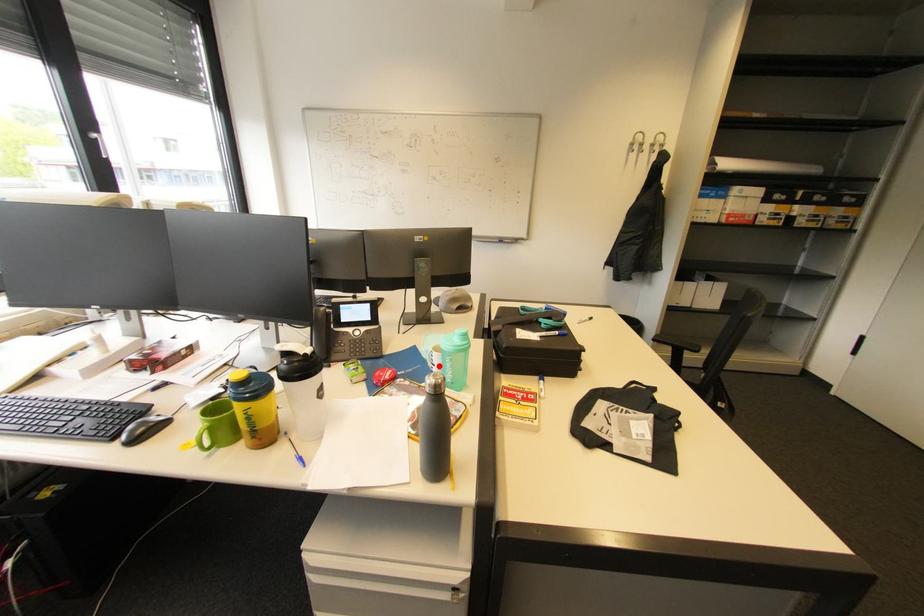
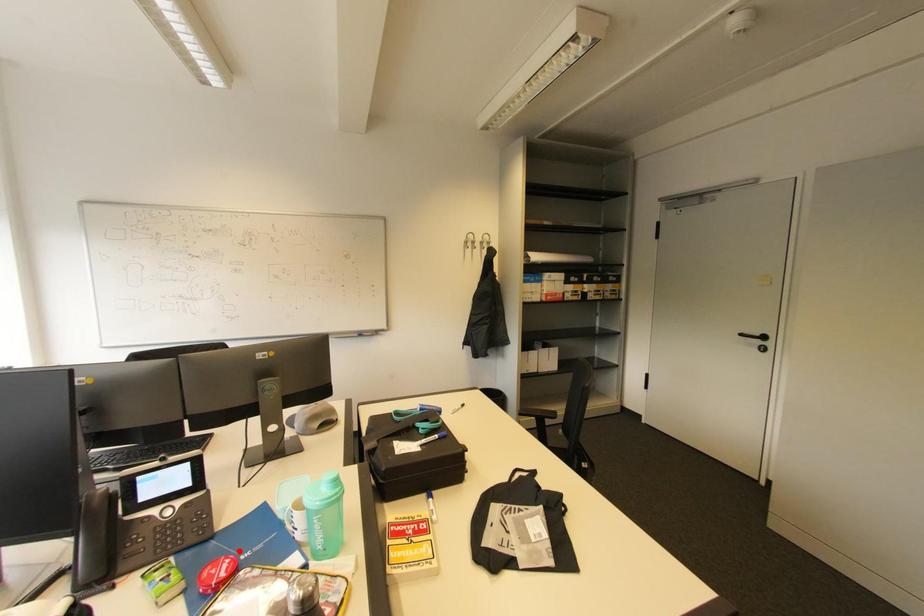
I am providing you with two images of the same scene from different viewpoints. A red point is marked on the first image and another point is marked on the second image. Do the highlighted points in image1 and image2 indicate the same real-world spot?

No